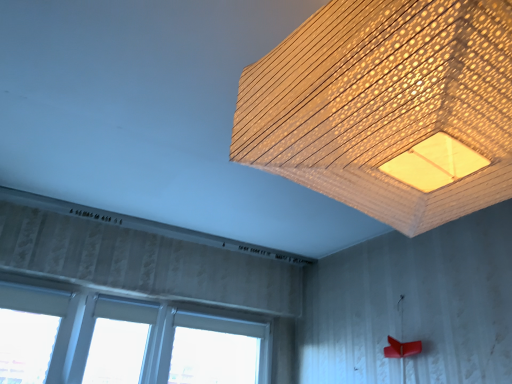
Question: From the image's perspective, relative to white plastic window at lower left, is wooden textured lampshade at upper center above or below?

Choices:
 (A) below
 (B) above

Answer: (B)

Question: Is wooden textured lampshade at upper center wider or thinner than white plastic window at lower left?

Choices:
 (A) thin
 (B) wide

Answer: (B)

Question: From their relative heights in the image, would you say wooden textured lampshade at upper center is taller or shorter than white plastic window at lower left?

Choices:
 (A) tall
 (B) short

Answer: (B)

Question: From the image's perspective, is white plastic window at lower left above or below wooden textured lampshade at upper center?

Choices:
 (A) above
 (B) below

Answer: (B)

Question: Considering the relative positions of white plastic window at lower left and wooden textured lampshade at upper center in the image provided, is white plastic window at lower left to the left or to the right of wooden textured lampshade at upper center?

Choices:
 (A) left
 (B) right

Answer: (A)

Question: In terms of size, does white plastic window at lower left appear bigger or smaller than wooden textured lampshade at upper center?

Choices:
 (A) big
 (B) small

Answer: (B)

Question: Is point (55, 360) positioned closer to the camera than point (493, 8)?

Choices:
 (A) closer
 (B) farther

Answer: (B)